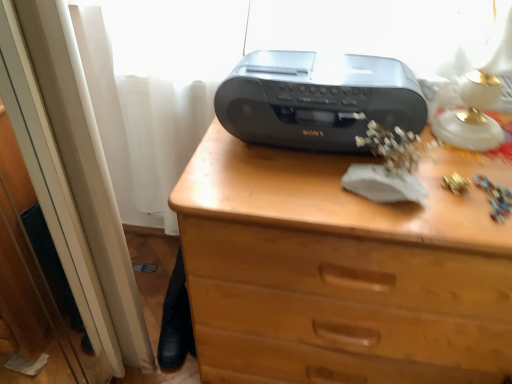
Locate an element on the screen. vacant region in front of white glossy table lamp at upper right is located at coordinates (468, 207).